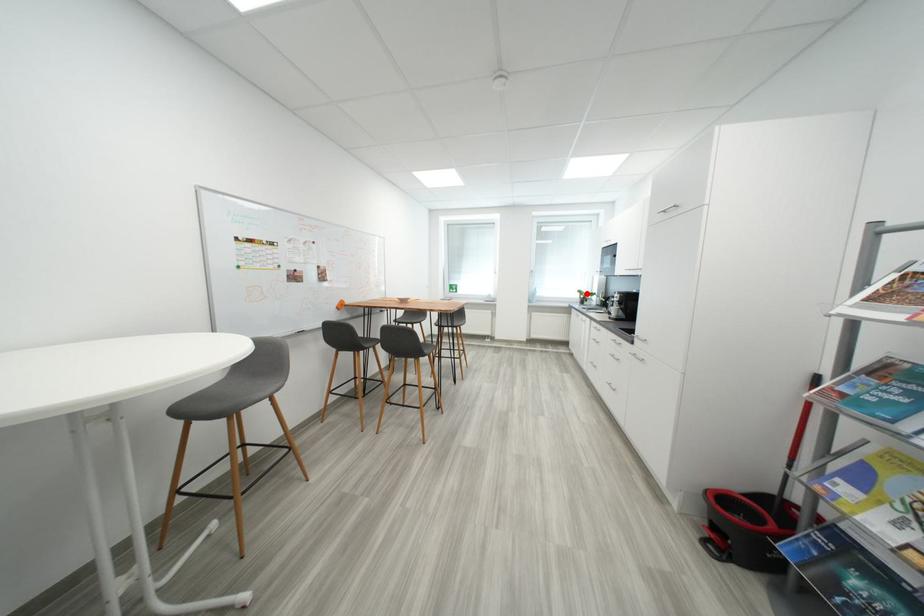
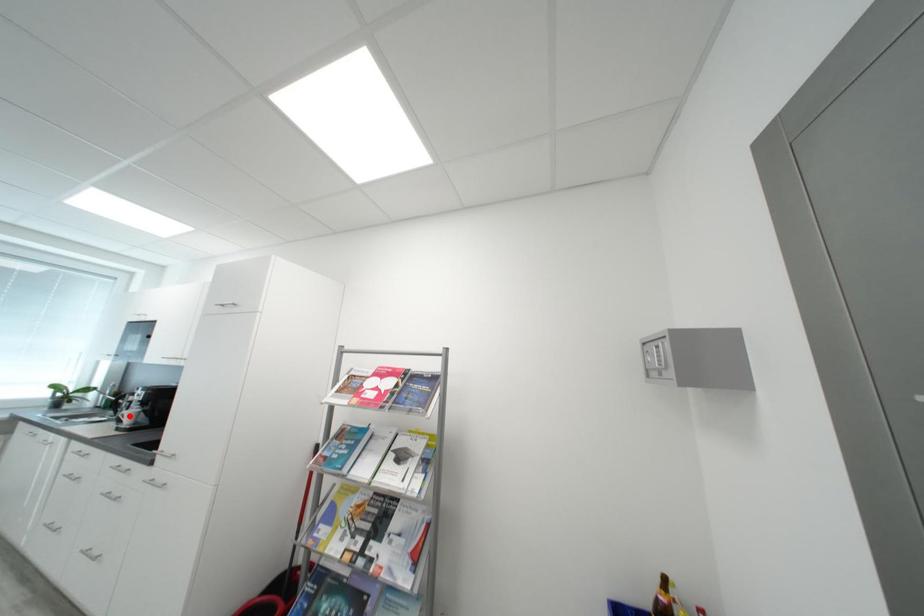
I am providing you with two images of the same scene from different viewpoints. A red point is marked on the first image and another point is marked on the second image. Are the points marked in image1 and image2 representing the same 3D position?

→ No